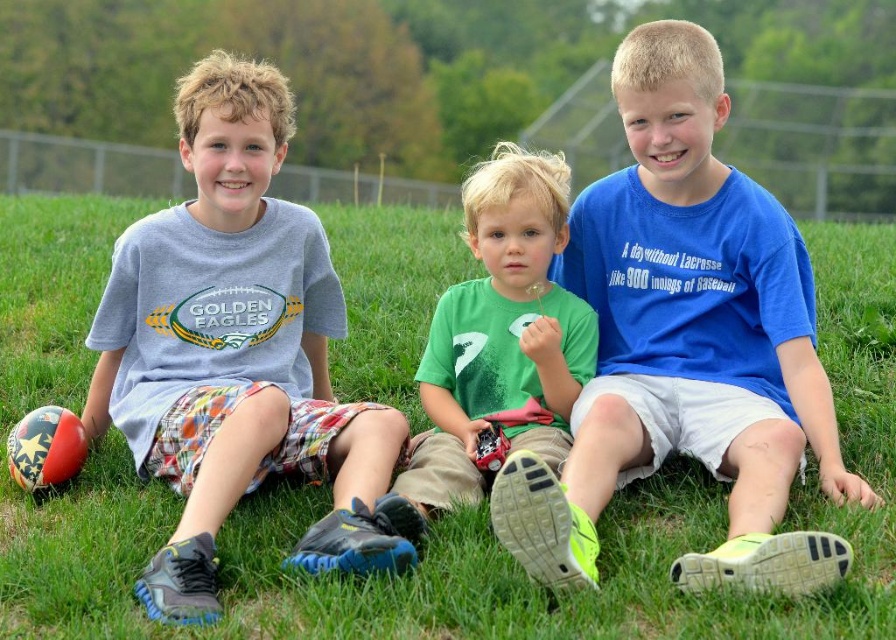
Locate an element on the screen. The height and width of the screenshot is (640, 896). green grass at center is located at coordinates (431, 522).

This screenshot has height=640, width=896. What do you see at coordinates (431, 522) in the screenshot? I see `green grass at center` at bounding box center [431, 522].

Find the location of a particular element. green grass at center is located at coordinates (431, 522).

Describe the element at coordinates (431, 522) in the screenshot. I see `green grass at center` at that location.

Measure the distance between green grass at center and camera.

green grass at center is 19.96 feet from camera.

Where is `green grass at center`? Image resolution: width=896 pixels, height=640 pixels. green grass at center is located at coordinates (431, 522).

Does green grass at center have a larger size compared to green matte shirt at center?

Actually, green grass at center might be smaller than green matte shirt at center.

At what (x,y) coordinates should I click in order to perform the action: click on green grass at center. Please return your answer as a coordinate pair (x, y). The image size is (896, 640). Looking at the image, I should click on (431, 522).

This screenshot has width=896, height=640. What are the coordinates of `green grass at center` in the screenshot? It's located at (431, 522).